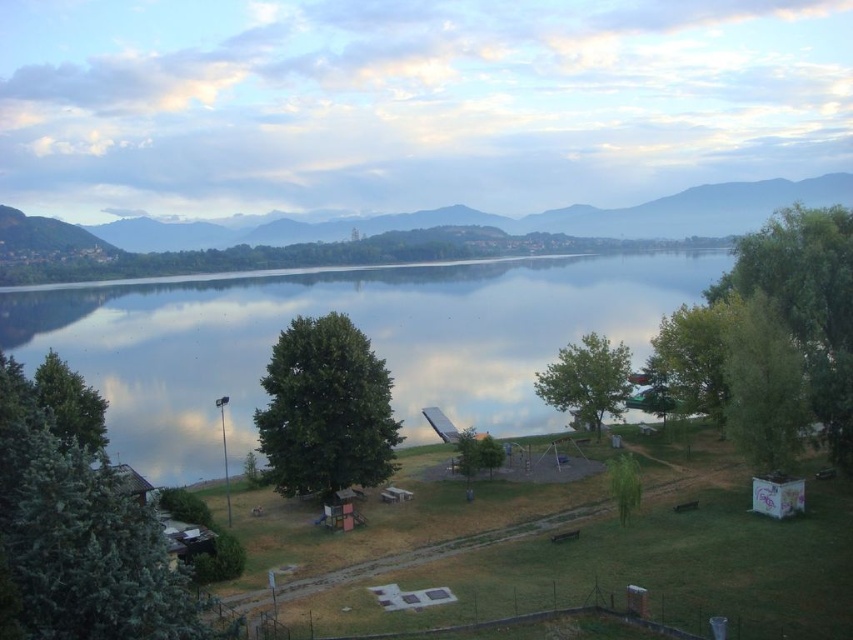
Question: Does glossy reflective water at center have a larger size compared to matte gray mountain at center?

Choices:
 (A) yes
 (B) no

Answer: (A)

Question: Which of the following is the closest to the observer?

Choices:
 (A) (399, 230)
 (B) (146, 355)

Answer: (B)

Question: Does glossy reflective water at center appear over matte gray mountain at center?

Choices:
 (A) no
 (B) yes

Answer: (A)

Question: Which point appears closest to the camera in this image?

Choices:
 (A) (498, 285)
 (B) (463, 216)

Answer: (A)

Question: Which object appears closest to the camera in this image?

Choices:
 (A) glossy reflective water at center
 (B) matte gray mountain at center

Answer: (A)

Question: Does glossy reflective water at center have a lesser width compared to matte gray mountain at center?

Choices:
 (A) no
 (B) yes

Answer: (B)